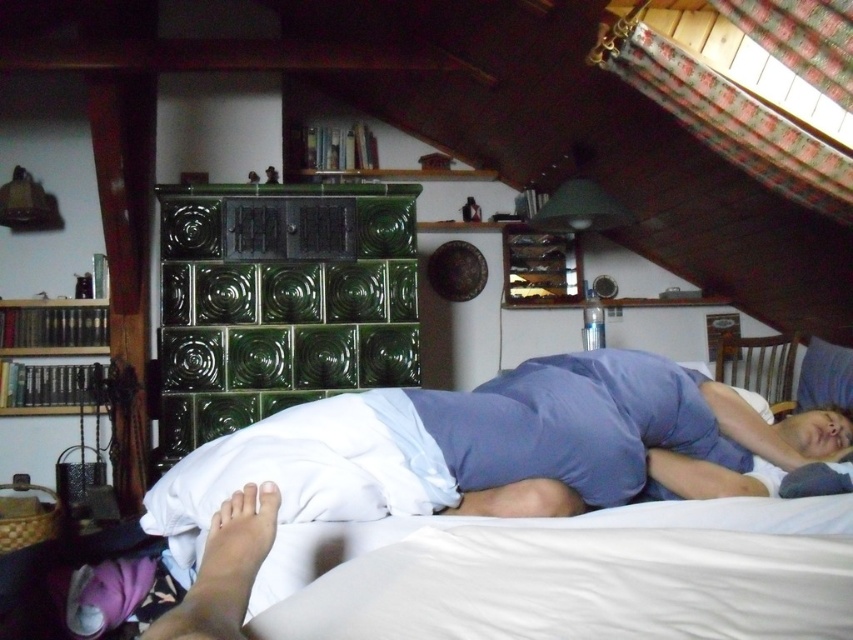
You are a delivery person who needs to place a small package on the closest object to you in the bedroom. Which object should you choose between the white soft foot at lower left and the white soft pillow at upper center?

The white soft foot at lower left is closer to the viewer than the white soft pillow at upper center, so you should place the package on the white soft foot at lower left.

You are standing in the bedroom and want to move from the white soft foot at lower left to the white soft bed at lower center. Which direction should you move in?

You should move to the right to reach the white soft bed at lower center from the white soft foot at lower left because the white soft bed at lower center is located to the right of the white soft foot at lower left.